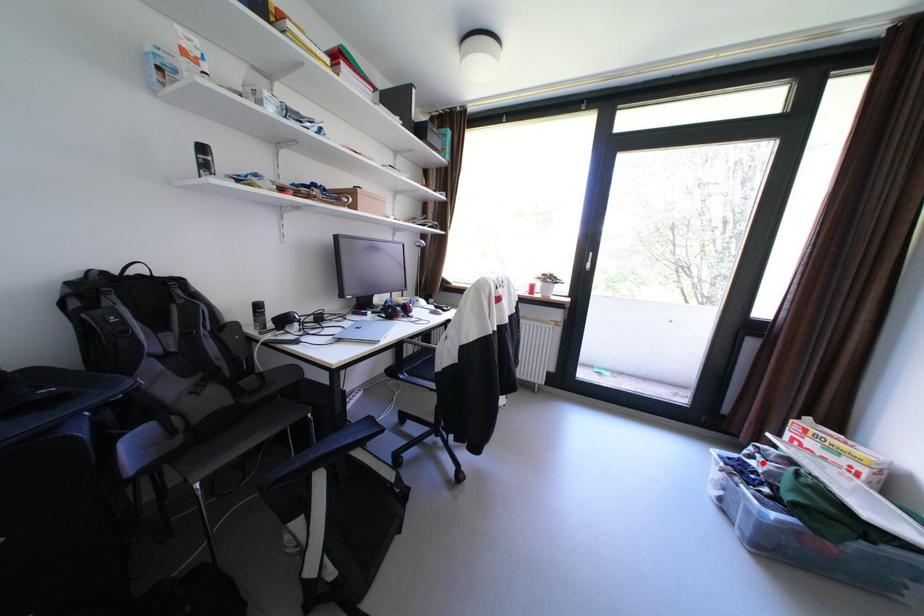
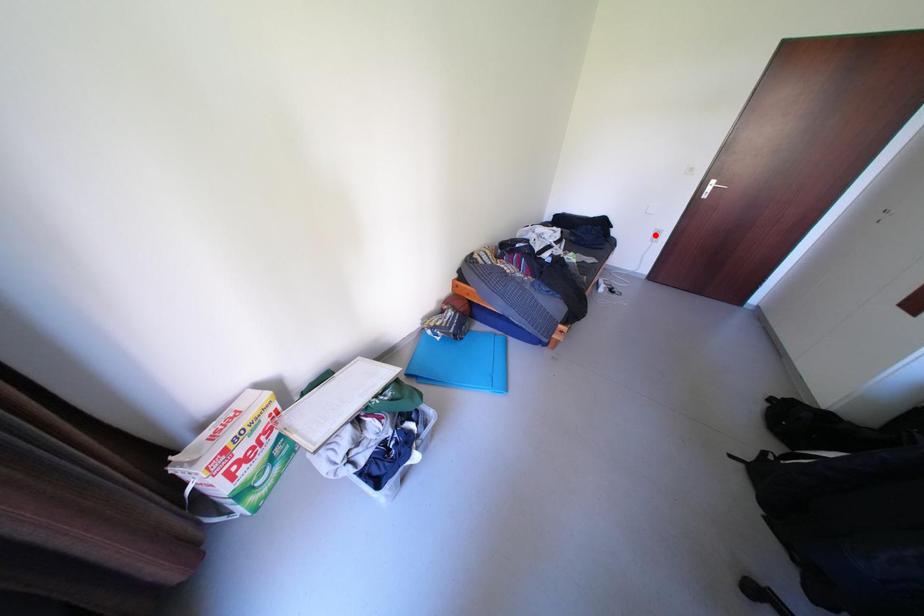
I am providing you with two images of the same scene from different viewpoints. A red point is marked on the first image and another point is marked on the second image. Are the points marked in image1 and image2 representing the same 3D position?

No